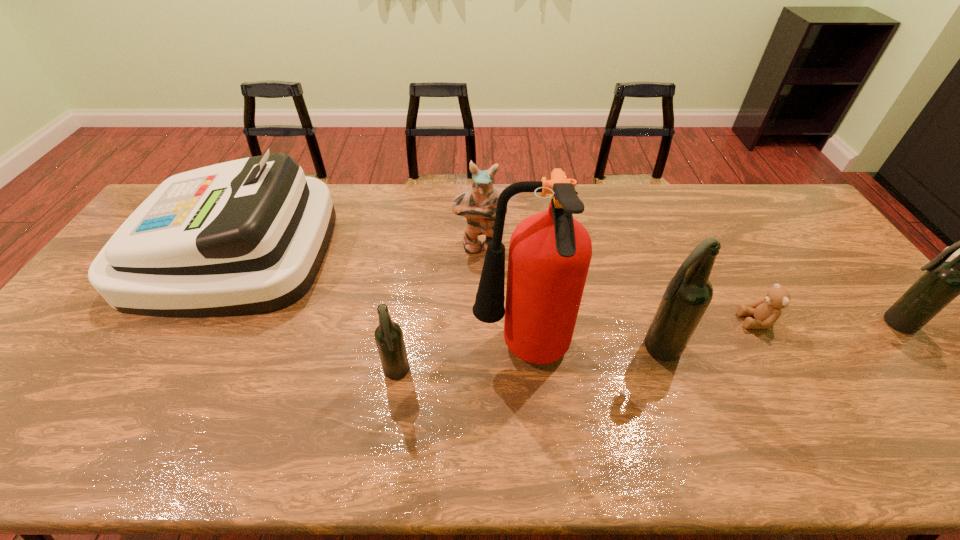
Locate an element on the screen. fire extinguisher is located at coordinates (550, 252).

The height and width of the screenshot is (540, 960). In order to click on vacant space located on the right of the shortest beer bottle in this screenshot , I will do `click(572, 374)`.

This screenshot has height=540, width=960. Find the location of `vacant space located 0.370m on the right of the fifth object from left to right`. vacant space located 0.370m on the right of the fifth object from left to right is located at coordinates (x=825, y=347).

Identify the location of free region located 0.210m on the back of the second tallest beer bottle. The image size is (960, 540). (841, 259).

Find the location of a particular element. vacant space located on the right of the cash register is located at coordinates (369, 249).

Identify the location of free location located on the front-facing side of the figurine. The height and width of the screenshot is (540, 960). (480, 277).

Find the location of a particular element. This screenshot has height=540, width=960. blank area located 0.140m on the face of the shortest object is located at coordinates (688, 321).

This screenshot has height=540, width=960. Find the location of `free space located on the face of the shortest object`. free space located on the face of the shortest object is located at coordinates (699, 321).

Locate an element on the screen. This screenshot has height=540, width=960. free space located on the face of the shortest object is located at coordinates (666, 321).

The height and width of the screenshot is (540, 960). What are the coordinates of `vacant position located at the nozzle of the fire extinguisher` in the screenshot? It's located at (320, 353).